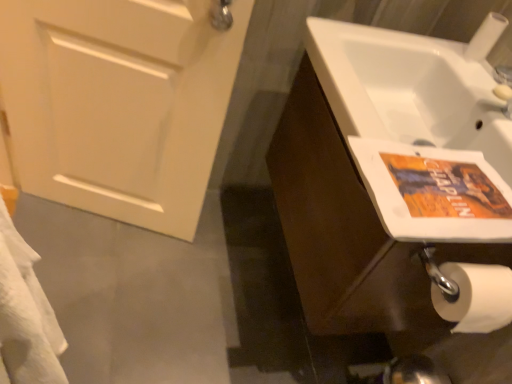
Locate an element on the screen. The image size is (512, 384). free space to the left of white matte toilet paper at lower right is located at coordinates (435, 46).